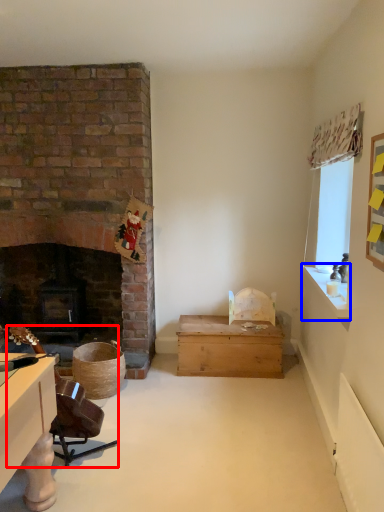
Question: Which point is closer to the camera, swivel chair (highlighted by a red box) or window sill (highlighted by a blue box)?

Choices:
 (A) swivel chair
 (B) window sill

Answer: (A)